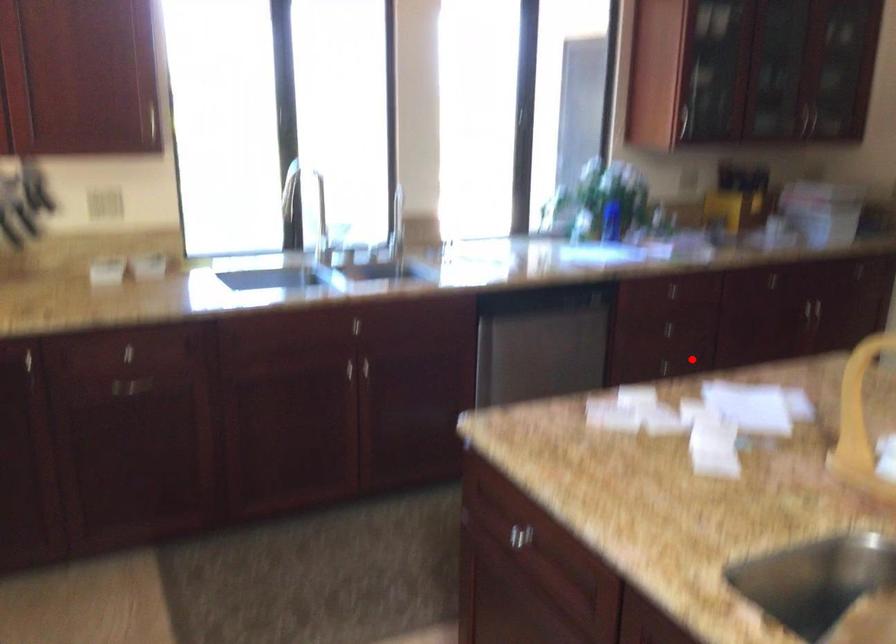
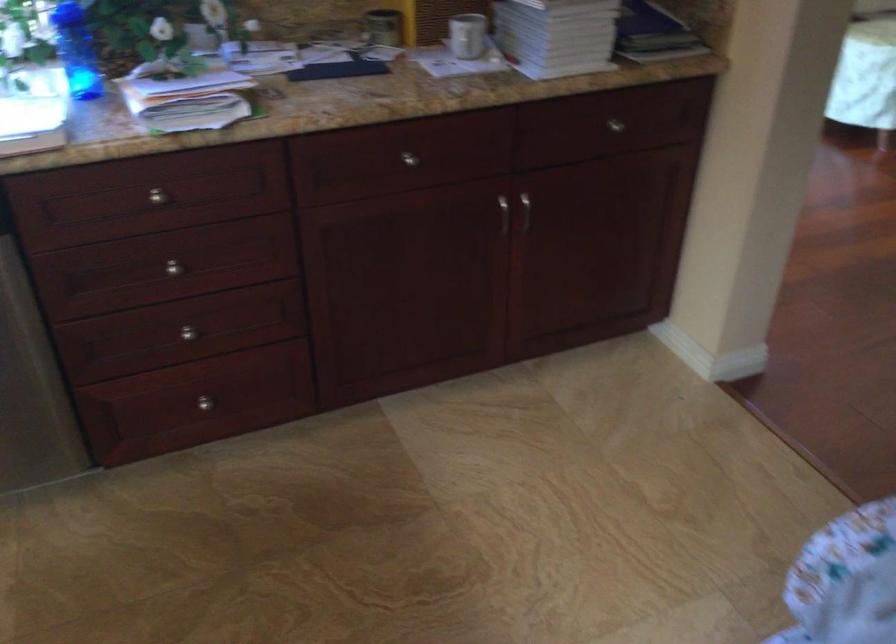
Question: A red point is marked in image1. In image2, is the corresponding 3D point closer to the camera or farther? Reply with the corresponding letter.

Choices:
 (A) The corresponding 3D point is closer.
 (B) The corresponding 3D point is farther.

Answer: (A)